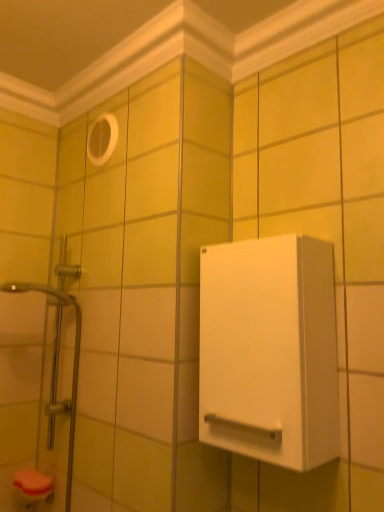
Question: From a real-world perspective, is white matte cabinet at right located higher than translucent glass shower door at left?

Choices:
 (A) no
 (B) yes

Answer: (B)

Question: Is white matte cabinet at right facing away from translucent glass shower door at left?

Choices:
 (A) no
 (B) yes

Answer: (A)

Question: Would you say white matte cabinet at right is a long distance from translucent glass shower door at left?

Choices:
 (A) no
 (B) yes

Answer: (A)

Question: Is white matte cabinet at right to the right of translucent glass shower door at left from the viewer's perspective?

Choices:
 (A) no
 (B) yes

Answer: (B)

Question: Can you confirm if white matte cabinet at right is taller than translucent glass shower door at left?

Choices:
 (A) no
 (B) yes

Answer: (A)

Question: From a real-world perspective, is white matte cabinet at right physically located above or below translucent glass shower door at left?

Choices:
 (A) below
 (B) above

Answer: (B)

Question: Is white matte cabinet at right taller or shorter than translucent glass shower door at left?

Choices:
 (A) short
 (B) tall

Answer: (A)

Question: Visually, is white matte cabinet at right positioned to the left or to the right of translucent glass shower door at left?

Choices:
 (A) right
 (B) left

Answer: (A)

Question: Is point (284, 382) closer or farther from the camera than point (77, 323)?

Choices:
 (A) closer
 (B) farther

Answer: (A)

Question: From a real-world perspective, is white matte cabinet at right above or below white plastic hole at upper center?

Choices:
 (A) above
 (B) below

Answer: (B)

Question: Is white matte cabinet at right to the left or to the right of white plastic hole at upper center in the image?

Choices:
 (A) left
 (B) right

Answer: (B)

Question: Is white matte cabinet at right in front of or behind white plastic hole at upper center in the image?

Choices:
 (A) behind
 (B) front

Answer: (B)

Question: Considering the positions of white matte cabinet at right and white plastic hole at upper center in the image, is white matte cabinet at right bigger or smaller than white plastic hole at upper center?

Choices:
 (A) small
 (B) big

Answer: (B)

Question: Does point pos(115,123) appear closer or farther from the camera than point pos(200,382)?

Choices:
 (A) farther
 (B) closer

Answer: (A)

Question: Considering their positions, is white plastic hole at upper center located in front of or behind white matte cabinet at right?

Choices:
 (A) behind
 (B) front

Answer: (A)